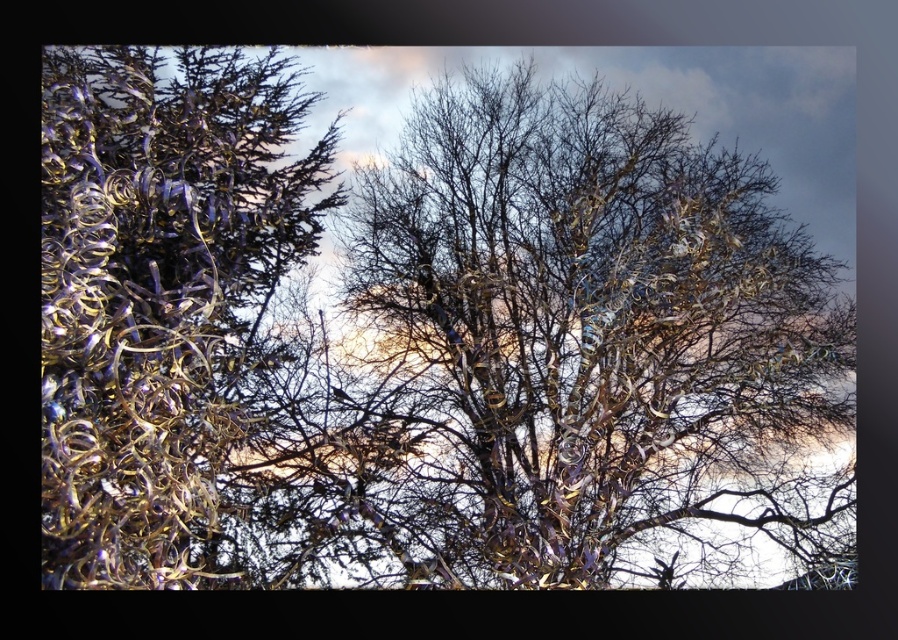
Is metallic gold tree at center below metallic gold tinsel at left?

Yes, metallic gold tree at center is below metallic gold tinsel at left.

Does metallic gold tree at center have a larger size compared to metallic gold tinsel at left?

Yes, metallic gold tree at center is bigger than metallic gold tinsel at left.

This screenshot has width=898, height=640. Identify the location of metallic gold tree at center. (557, 352).